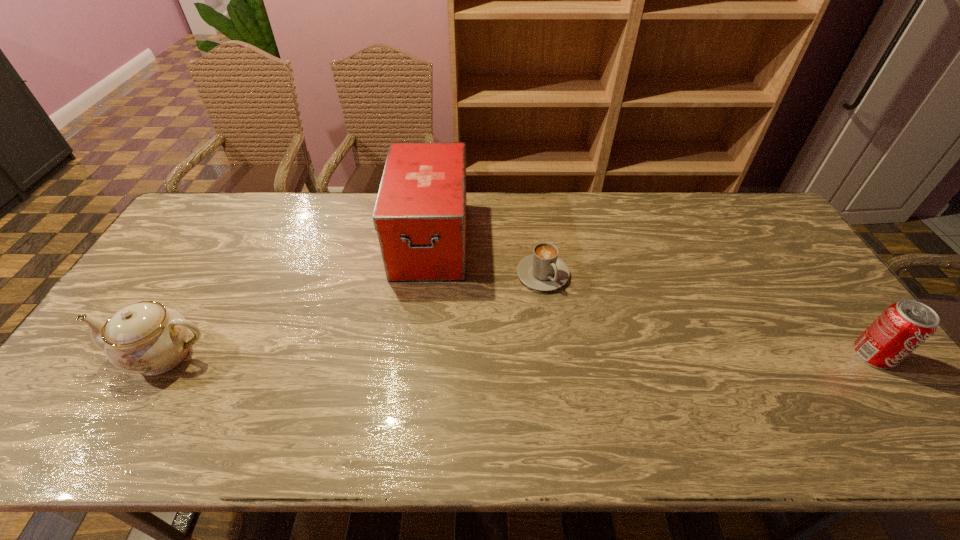
Where is `vacant region located on the handle side of the tallest object`? vacant region located on the handle side of the tallest object is located at coordinates click(416, 394).

In order to click on vacant space situated 0.160m on the handle side of the tallest object in this screenshot , I will do `click(421, 327)`.

Identify the location of free region located on the handle side of the tallest object. The height and width of the screenshot is (540, 960). (423, 310).

In order to click on object located at the far edge in this screenshot , I will do `click(420, 214)`.

The height and width of the screenshot is (540, 960). I want to click on object that is positioned at the near edge, so click(x=146, y=337).

Where is `object present at the left edge`? object present at the left edge is located at coordinates (146, 337).

You are a GUI agent. You are given a task and a screenshot of the screen. Output one action in this format:
    pyautogui.click(x=<x>, y=<y>)
    Task: Click on the object that is at the right edge
    This screenshot has height=540, width=960.
    Given the screenshot: What is the action you would take?
    pyautogui.click(x=903, y=326)

Locate an element on the screen. object that is at the near left corner is located at coordinates (146, 337).

The height and width of the screenshot is (540, 960). In the image, there is a desktop. Find the location of `vacant space at the far edge`. vacant space at the far edge is located at coordinates (309, 232).

The image size is (960, 540). Find the location of `vacant point at the near edge`. vacant point at the near edge is located at coordinates (785, 405).